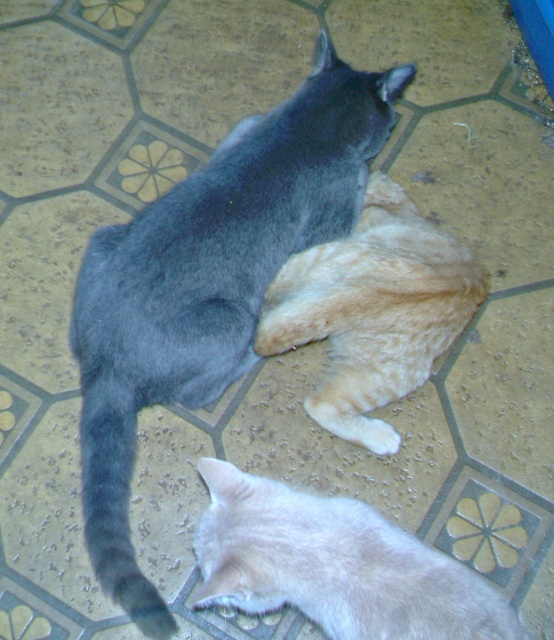
You are a photographer trying to capture a photo of both the gray matte cat at upper center and the tabby fur cat at lower center. Based on their positions, which cat would require you to zoom in more to include both in the frame?

The gray matte cat at upper center might be wider than the tabby fur cat at lower center, so you might need to zoom out slightly to include both in the frame.

You are a photographer trying to capture a photo of the gray matte cat at upper center and the tabby fur cat at lower center. Since you want to focus on the taller cat, which one should you adjust your camera settings for?

The gray matte cat at upper center is much taller than the tabby fur cat at lower center, so you should adjust your camera settings for the gray matte cat at upper center.

You are a photographer trying to capture both the gray matte cat at upper center and the tabby fur cat at lower center in a single shot. Given that your camera has a fixed focus that can only clearly capture the larger of the two cats, which cat will be in focus?

The gray matte cat at upper center is bigger than the tabby fur cat at lower center, so the camera will focus on the gray matte cat at upper center.